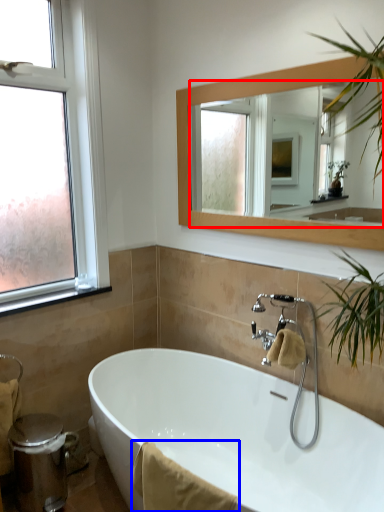
Question: Which object appears closest to the camera in this image, mirror (highlighted by a red box) or bath towel (highlighted by a blue box)?

Choices:
 (A) mirror
 (B) bath towel

Answer: (B)